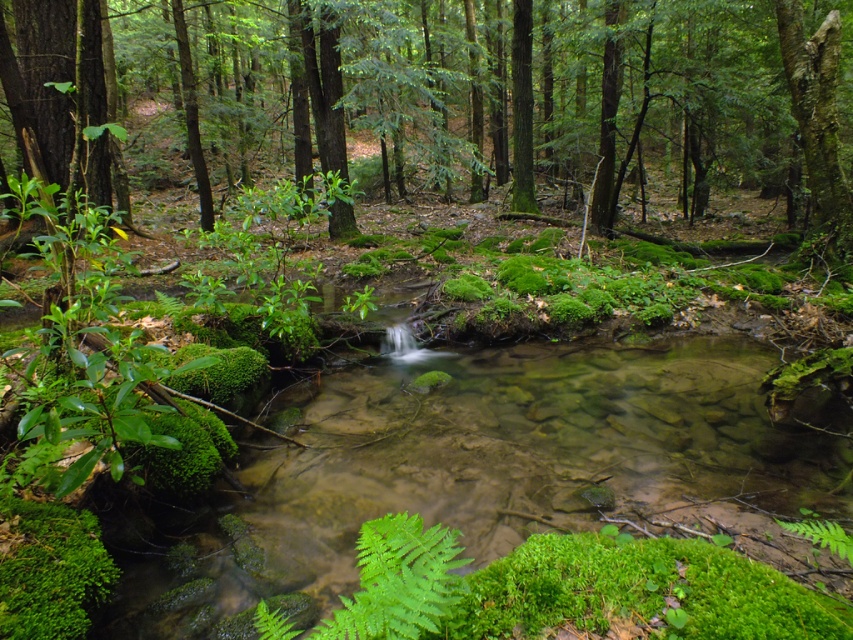
Who is more distant from viewer, (x=409, y=44) or (x=93, y=186)?

The point (x=409, y=44) is more distant.

Can you confirm if green mossy tree at center is positioned above green matte tree at left?

Yes.

Where is `green mossy tree at center`? This screenshot has width=853, height=640. green mossy tree at center is located at coordinates (518, 92).

At what (x,y) coordinates should I click in order to perform the action: click on green mossy tree at center. Please return your answer as a coordinate pair (x, y). Looking at the image, I should click on (518, 92).

Is green matte tree at left to the left of smooth bark tree at upper right from the viewer's perspective?

Indeed, green matte tree at left is positioned on the left side of smooth bark tree at upper right.

Is point (97, 96) closer to camera compared to point (838, 49)?

That is True.

Locate an element on the screen. Image resolution: width=853 pixels, height=640 pixels. green matte tree at left is located at coordinates (x=57, y=90).

Can you confirm if clear glass stream at center is smaller than green mossy tree at center?

Yes.

Which is more to the left, clear glass stream at center or green mossy tree at center?

Positioned to the left is green mossy tree at center.

Who is more distant from viewer, (727, 516) or (350, 68)?

Point (350, 68)

What are the coordinates of `clear glass stream at center` in the screenshot? It's located at (506, 493).